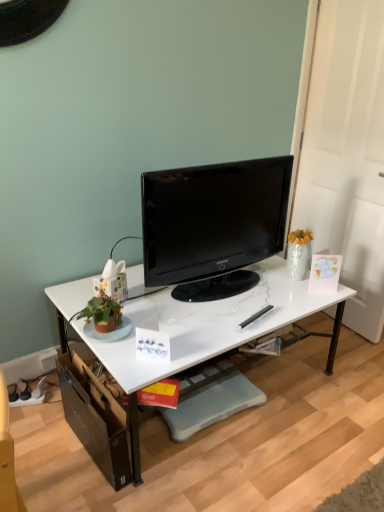
Locate an element on the screen. black glossy tv at center is located at coordinates (213, 225).

The width and height of the screenshot is (384, 512). What do you see at coordinates (213, 225) in the screenshot?
I see `black glossy tv at center` at bounding box center [213, 225].

The width and height of the screenshot is (384, 512). What do you see at coordinates (210, 331) in the screenshot?
I see `white glossy desk at center` at bounding box center [210, 331].

Where is `white glossy desk at center`? white glossy desk at center is located at coordinates (210, 331).

The image size is (384, 512). In order to click on black glossy tv at center in this screenshot , I will do `click(213, 225)`.

Which is more to the left, white glossy desk at center or black glossy tv at center?

From the viewer's perspective, white glossy desk at center appears more on the left side.

Considering the relative positions of white glossy desk at center and black glossy tv at center in the image provided, is white glossy desk at center behind black glossy tv at center?

That is False.

Is point (102, 355) positioned after point (184, 288)?

That is False.

From the image's perspective, does white glossy desk at center appear higher than black glossy tv at center?

Incorrect, from the image's perspective, white glossy desk at center is lower than black glossy tv at center.

From a real-world perspective, between white glossy desk at center and black glossy tv at center, who is vertically higher?

black glossy tv at center.

From the picture: Considering the relative sizes of white glossy desk at center and black glossy tv at center in the image provided, is white glossy desk at center wider than black glossy tv at center?

Yes.

Looking at this image, in terms of height, does white glossy desk at center look taller or shorter compared to black glossy tv at center?

In the image, white glossy desk at center appears to be shorter than black glossy tv at center.

Is white glossy desk at center bigger or smaller than black glossy tv at center?

Considering their sizes, white glossy desk at center takes up more space than black glossy tv at center.

Would you say white glossy desk at center is inside or outside black glossy tv at center?

white glossy desk at center is spatially situated outside black glossy tv at center.

Is white glossy desk at center with black glossy tv at center?

No, white glossy desk at center is not touching black glossy tv at center.

Does white glossy desk at center turn towards black glossy tv at center?

No.

How many degrees apart are the facing directions of white glossy desk at center and black glossy tv at center?

The facing directions of white glossy desk at center and black glossy tv at center are 3.32 degrees apart.

At what (x,y) coordinates should I click in order to perform the action: click on desk below the black glossy tv at center (from a real-world perspective). Please return your answer as a coordinate pair (x, y). This screenshot has width=384, height=512. Looking at the image, I should click on (210, 331).

From the picture: Considering the relative positions of black glossy tv at center and white glossy desk at center in the image provided, is black glossy tv at center to the left of white glossy desk at center from the viewer's perspective?

No.

Who is more distant, black glossy tv at center or white glossy desk at center?

black glossy tv at center is further from the camera.

Does point (235, 249) lie behind point (204, 328)?

Yes, point (235, 249) is behind point (204, 328).

From the picture: From the image's perspective, is black glossy tv at center over white glossy desk at center?

Yes, from the image's perspective, black glossy tv at center is above white glossy desk at center.

Looking at this image, from a real-world perspective, which is physically below, black glossy tv at center or white glossy desk at center?

From a 3D spatial view, white glossy desk at center is below.

Between black glossy tv at center and white glossy desk at center, which one has smaller width?

With smaller width is black glossy tv at center.

Does black glossy tv at center have a lesser height compared to white glossy desk at center?

Incorrect, the height of black glossy tv at center does not fall short of that of white glossy desk at center.

Is black glossy tv at center bigger than white glossy desk at center?

No.

Is black glossy tv at center located outside white glossy desk at center?

black glossy tv at center lies outside white glossy desk at center's area.

Is black glossy tv at center not close to white glossy desk at center?

Actually, black glossy tv at center and white glossy desk at center are a little close together.

Is black glossy tv at center turned away from white glossy desk at center?

black glossy tv at center is not turned away from white glossy desk at center.

Measure the distance from black glossy tv at center to white glossy desk at center.

black glossy tv at center is 11.49 inches away from white glossy desk at center.

This screenshot has width=384, height=512. What are the coordinates of `desk that appears on the left of black glossy tv at center` in the screenshot? It's located at (210, 331).

The width and height of the screenshot is (384, 512). I want to click on desk lying on the left of black glossy tv at center, so click(210, 331).

The height and width of the screenshot is (512, 384). Find the location of `television behind the white glossy desk at center`. television behind the white glossy desk at center is located at coordinates (213, 225).